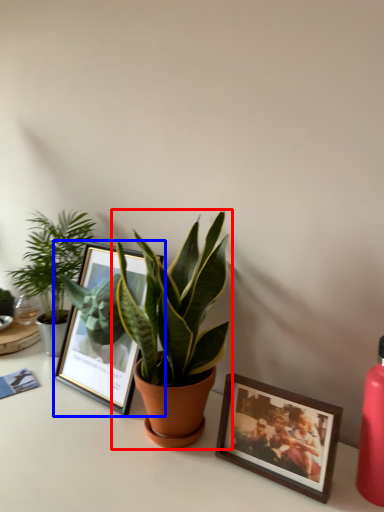
Question: Which point is closer to the camera, houseplant (highlighted by a red box) or picture frame (highlighted by a blue box)?

Choices:
 (A) houseplant
 (B) picture frame

Answer: (A)